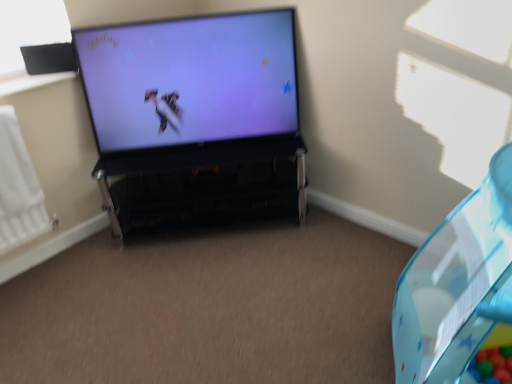
The width and height of the screenshot is (512, 384). What do you see at coordinates (49, 58) in the screenshot?
I see `black matte speaker at upper left` at bounding box center [49, 58].

The width and height of the screenshot is (512, 384). What do you see at coordinates (18, 188) in the screenshot?
I see `white matte radiator at left` at bounding box center [18, 188].

The width and height of the screenshot is (512, 384). What do you see at coordinates (203, 183) in the screenshot?
I see `black glossy tv stand at center` at bounding box center [203, 183].

The width and height of the screenshot is (512, 384). Describe the element at coordinates (191, 89) in the screenshot. I see `matte black television at center` at that location.

Where is `black matte speaker at upper left`? The width and height of the screenshot is (512, 384). black matte speaker at upper left is located at coordinates (49, 58).

Is white matte radiator at left surrounded by transparent plastic bean bag chair at right?

No.

Between point (474, 200) and point (0, 235), which one is positioned behind?

Positioned behind is point (0, 235).

Which is more to the right, transparent plastic bean bag chair at right or white matte radiator at left?

From the viewer's perspective, transparent plastic bean bag chair at right appears more on the right side.

Considering the sizes of transparent plastic bean bag chair at right and white matte radiator at left in the image, is transparent plastic bean bag chair at right taller or shorter than white matte radiator at left?

Clearly, transparent plastic bean bag chair at right is taller compared to white matte radiator at left.

Is transparent plastic bean bag chair at right closer to camera compared to matte black television at center?

Yes, transparent plastic bean bag chair at right is in front of matte black television at center.

From the image's perspective, between transparent plastic bean bag chair at right and matte black television at center, who is located below?

From the image's view, transparent plastic bean bag chair at right is below.

In the scene shown: Considering the sizes of objects transparent plastic bean bag chair at right and matte black television at center in the image provided, who is bigger, transparent plastic bean bag chair at right or matte black television at center?

With larger size is transparent plastic bean bag chair at right.

Is black matte speaker at upper left oriented towards black glossy tv stand at center?

No, black matte speaker at upper left is not oriented towards black glossy tv stand at center.

Considering the positions of objects black matte speaker at upper left and black glossy tv stand at center in the image provided, who is more to the left, black matte speaker at upper left or black glossy tv stand at center?

From the viewer's perspective, black matte speaker at upper left appears more on the left side.

Which is closer to the camera, (196,218) or (49,67)?

Point (196,218) is positioned farther from the camera compared to point (49,67).

Which of these two, black glossy tv stand at center or black matte speaker at upper left, stands shorter?

With less height is black matte speaker at upper left.

This screenshot has width=512, height=384. I want to click on furniture on the right of black matte speaker at upper left, so click(x=203, y=183).

From the image's perspective, which is above, black glossy tv stand at center or black matte speaker at upper left?

black matte speaker at upper left.

Is black matte speaker at upper left aimed at matte black television at center?

No, black matte speaker at upper left does not turn towards matte black television at center.

Which object is further away from the camera, black matte speaker at upper left or matte black television at center?

black matte speaker at upper left is more distant.

From the image's perspective, is black matte speaker at upper left above or below matte black television at center?

From the image's perspective, black matte speaker at upper left appears above matte black television at center.

Is white matte radiator at left located outside matte black television at center?

That's correct, white matte radiator at left is outside of matte black television at center.

Based on the photo, from the image's perspective, is white matte radiator at left below matte black television at center?

Indeed, from the image's perspective, white matte radiator at left is shown beneath matte black television at center.

Measure the distance from white matte radiator at left to matte black television at center.

white matte radiator at left and matte black television at center are 74.95 centimeters apart from each other.

Does black matte speaker at upper left have a smaller size compared to white matte radiator at left?

Yes, black matte speaker at upper left is smaller than white matte radiator at left.

From the picture: Is black matte speaker at upper left oriented away from white matte radiator at left?

That's not correct — black matte speaker at upper left is not looking away from white matte radiator at left.

In terms of height, does black matte speaker at upper left look taller or shorter compared to white matte radiator at left?

Clearly, black matte speaker at upper left is shorter compared to white matte radiator at left.

Is point (37, 47) farther from viewer compared to point (16, 217)?

Yes, it is.

At what (x,y) coordinates should I click in order to perform the action: click on bean bag chair located on the right of white matte radiator at left. Please return your answer as a coordinate pair (x, y). Looking at the image, I should click on (455, 283).

Where is `bean bag chair in front of the matte black television at center`? The image size is (512, 384). bean bag chair in front of the matte black television at center is located at coordinates (455, 283).

In the scene shown: Which object lies nearer to the anchor point transparent plastic bean bag chair at right, matte black television at center or black glossy tv stand at center?

Based on the image, black glossy tv stand at center appears to be nearer to transparent plastic bean bag chair at right.

Considering their positions, is black matte speaker at upper left positioned further to transparent plastic bean bag chair at right than matte black television at center?

black matte speaker at upper left lies further to transparent plastic bean bag chair at right than the other object.

Considering their positions, is transparent plastic bean bag chair at right positioned further to matte black television at center than black matte speaker at upper left?

The object further to matte black television at center is transparent plastic bean bag chair at right.

Estimate the real-world distances between objects in this image. Which object is further from transparent plastic bean bag chair at right, white matte radiator at left or matte black television at center?

white matte radiator at left is positioned further to the anchor transparent plastic bean bag chair at right.

Considering their positions, is black glossy tv stand at center positioned further to transparent plastic bean bag chair at right than white matte radiator at left?

white matte radiator at left is further to transparent plastic bean bag chair at right.

Estimate the real-world distances between objects in this image. Which object is further from black glossy tv stand at center, matte black television at center or black matte speaker at upper left?

black matte speaker at upper left is positioned further to the anchor black glossy tv stand at center.

Which object lies nearer to the anchor point black matte speaker at upper left, black glossy tv stand at center or matte black television at center?

The object closer to black matte speaker at upper left is matte black television at center.

When comparing their distances from transparent plastic bean bag chair at right, does black matte speaker at upper left or white matte radiator at left seem further?

black matte speaker at upper left.

The height and width of the screenshot is (384, 512). Identify the location of furniture between black matte speaker at upper left and transparent plastic bean bag chair at right in the horizontal direction. (203, 183).

Locate an element on the screen. television situated between black matte speaker at upper left and transparent plastic bean bag chair at right from left to right is located at coordinates (191, 89).

Locate an element on the screen. speaker between white matte radiator at left and black glossy tv stand at center is located at coordinates (49, 58).

Find the location of `television situated between white matte radiator at left and black glossy tv stand at center from left to right`. television situated between white matte radiator at left and black glossy tv stand at center from left to right is located at coordinates (191, 89).